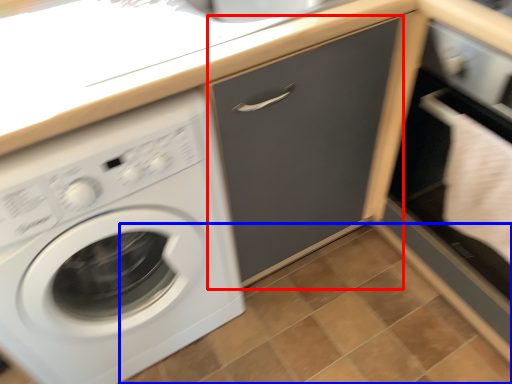
Question: Among these objects, which one is farthest to the camera, drawer (highlighted by a red box) or tile (highlighted by a blue box)?

Choices:
 (A) drawer
 (B) tile

Answer: (B)